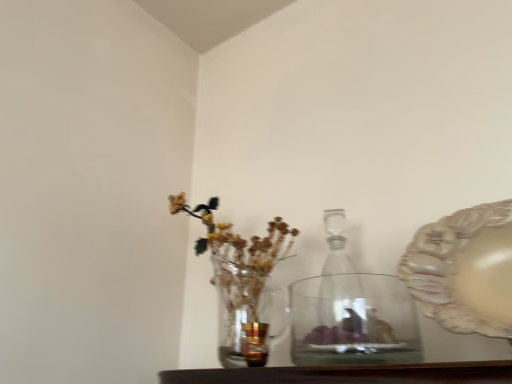
Question: From a real-world perspective, does clear glass vase at left stand above gold metallic candle holder at center?

Choices:
 (A) no
 (B) yes

Answer: (B)

Question: From the image's perspective, is clear glass vase at left beneath gold metallic candle holder at center?

Choices:
 (A) yes
 (B) no

Answer: (B)

Question: Is clear glass vase at left at the left side of gold metallic candle holder at center?

Choices:
 (A) no
 (B) yes

Answer: (B)

Question: From the image's perspective, is clear glass vase at left on gold metallic candle holder at center?

Choices:
 (A) yes
 (B) no

Answer: (A)

Question: Is the position of clear glass vase at left less distant than that of gold metallic candle holder at center?

Choices:
 (A) yes
 (B) no

Answer: (B)

Question: Would you say clear glass vase at left contains gold metallic candle holder at center?

Choices:
 (A) no
 (B) yes

Answer: (A)

Question: Considering the relative sizes of clear glass vase at left and transparent glass vase at center in the image provided, is clear glass vase at left thinner than transparent glass vase at center?

Choices:
 (A) yes
 (B) no

Answer: (B)

Question: Is clear glass vase at left wider than transparent glass vase at center?

Choices:
 (A) no
 (B) yes

Answer: (B)

Question: Can you confirm if clear glass vase at left is smaller than transparent glass vase at center?

Choices:
 (A) no
 (B) yes

Answer: (A)

Question: Does clear glass vase at left lie in front of transparent glass vase at center?

Choices:
 (A) no
 (B) yes

Answer: (A)

Question: From a real-world perspective, is clear glass vase at left beneath transparent glass vase at center?

Choices:
 (A) no
 (B) yes

Answer: (A)

Question: From the image's perspective, is clear glass vase at left on transparent glass vase at center?

Choices:
 (A) yes
 (B) no

Answer: (A)

Question: Could you tell me if transparent glass bottle at center is facing matte beige platter at right?

Choices:
 (A) no
 (B) yes

Answer: (A)